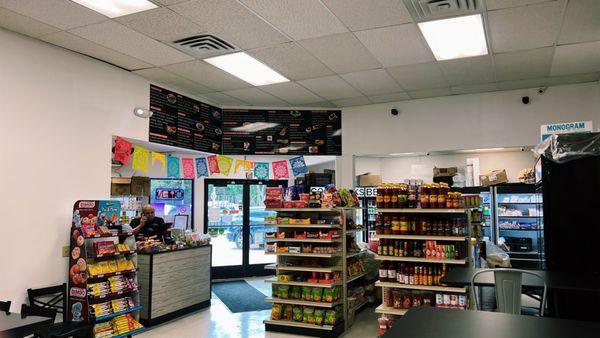
Locate an element on the screen. rug is located at coordinates (235, 285).